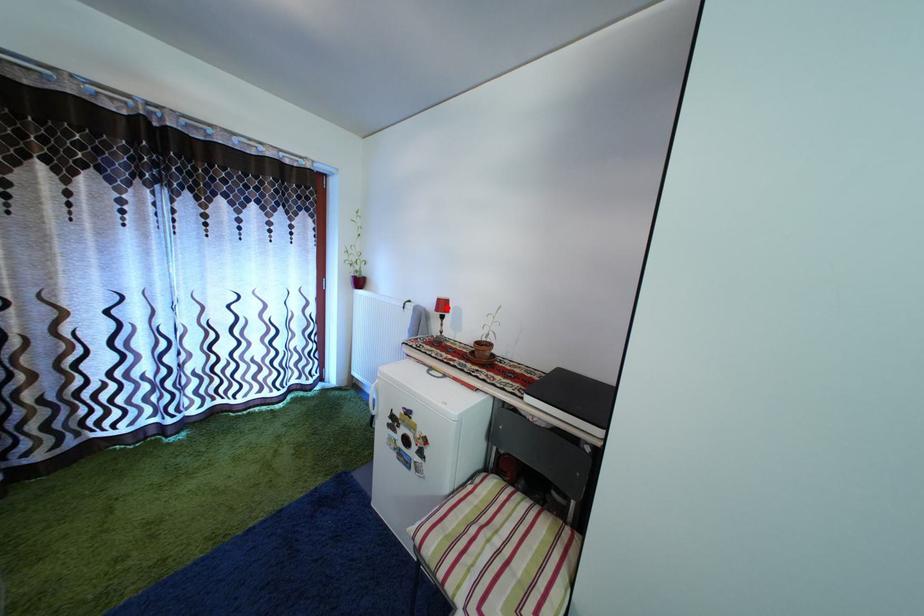
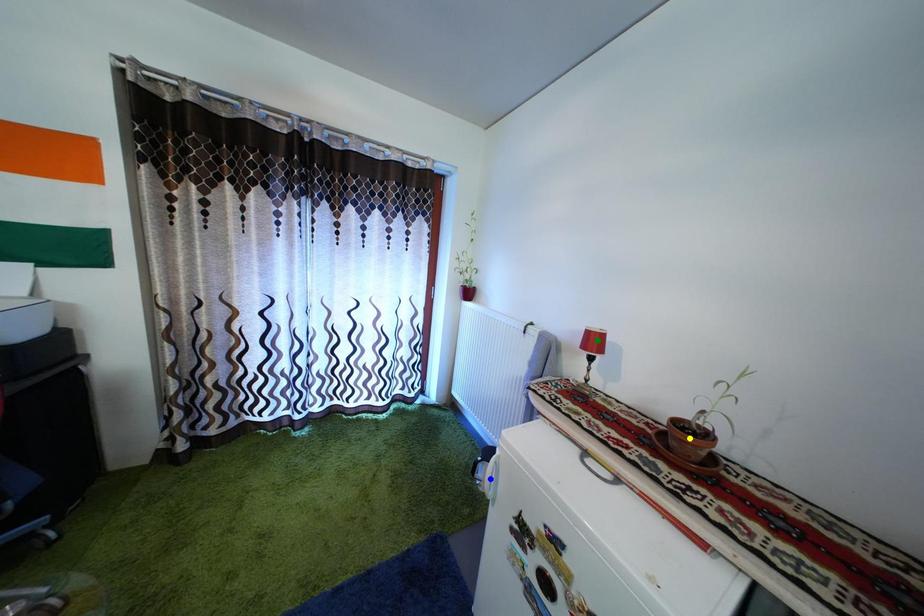
Question: I am providing you with two images of the same scene from different viewpoints. A red point is marked on the first image. You are given multiple points on the second image. Which point in image 2 represents the same 3d spot as the red point in image 1?

Choices:
 (A) green point
 (B) yellow point
 (C) blue point

Answer: (A)